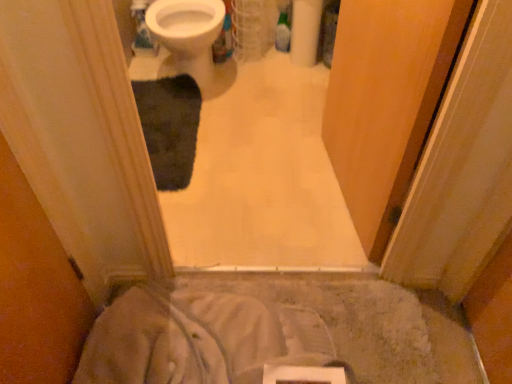
Where is `vacant space situated on the left part of wooden screen door at center`? This screenshot has width=512, height=384. vacant space situated on the left part of wooden screen door at center is located at coordinates (254, 188).